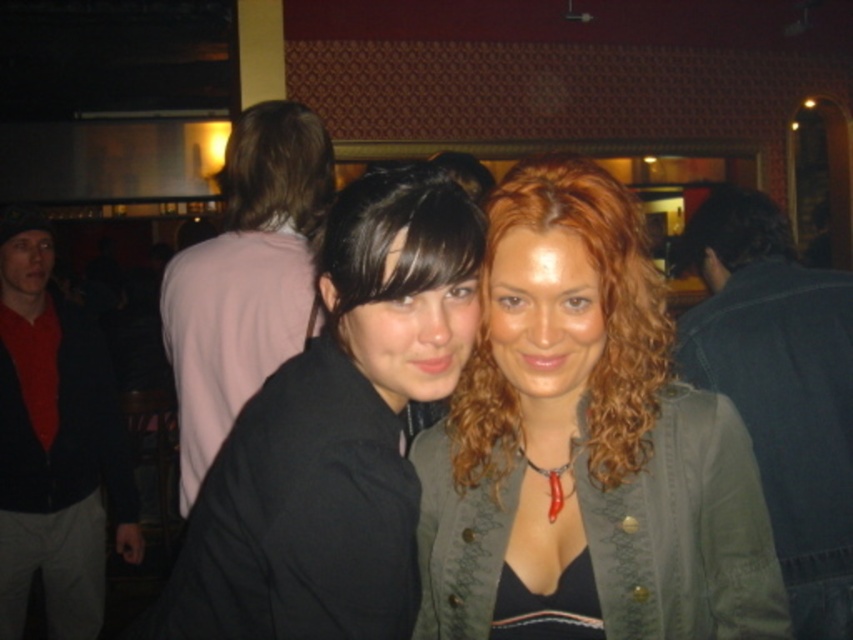
Question: Considering the relative positions of denim jacket at right and red shirt at left in the image provided, where is denim jacket at right located with respect to red shirt at left?

Choices:
 (A) above
 (B) below

Answer: (A)

Question: Which of the following is the farthest from the observer?

Choices:
 (A) matte green jacket at center
 (B) red shirt at left
 (C) matte black jacket at center
 (D) denim jacket at right

Answer: (B)

Question: Does pink fabric shirt at upper left have a lesser width compared to matte black jacket at center?

Choices:
 (A) yes
 (B) no

Answer: (A)

Question: Does denim jacket at right appear over matte black jacket at center?

Choices:
 (A) no
 (B) yes

Answer: (A)

Question: Among these objects, which one is farthest from the camera?

Choices:
 (A) matte black jacket at center
 (B) red shirt at left
 (C) black matte shirt at center
 (D) pink fabric shirt at upper left

Answer: (B)

Question: Which point appears farthest from the camera in this image?

Choices:
 (A) (178, 394)
 (B) (88, 474)
 (C) (845, 401)
 (D) (431, 573)

Answer: (B)